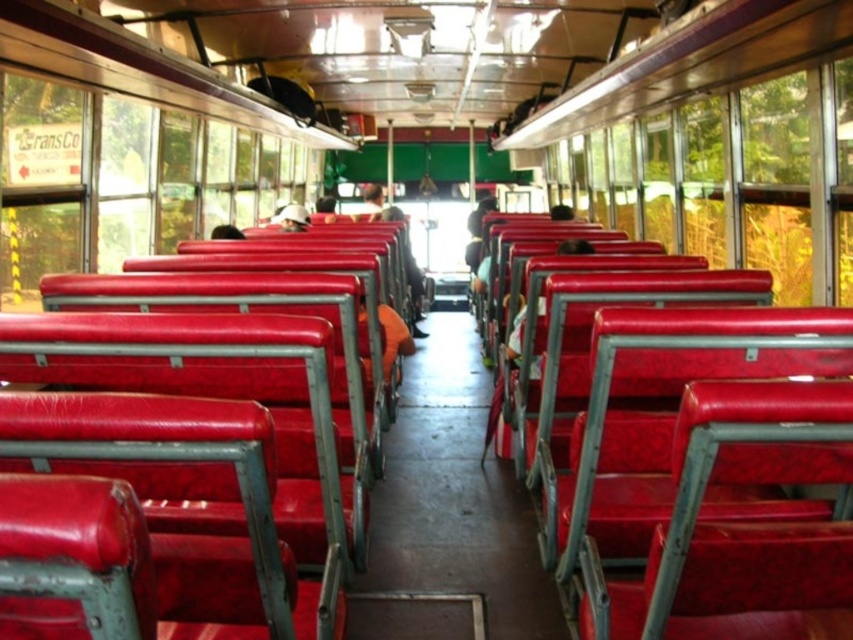
You are a bus passenger who wants to move from the point at (57, 180) to the front of the bus. The bus has a length of 4 meters. Can you reach the front without needing to step over any seats?

The distance between the point at (57, 180) and the front of the bus is 3.93 meters. Since the bus is 4 meters long, you can reach the front without needing to step over any seats as the distance is slightly less than the total length of the bus.

You are a passenger trying to find a seat on the bus. You see two seats at the center of the bus labeled as matte red seats at center and matte red seat at center. Which one is smaller in size?

The matte red seats at center has a smaller size compared to the matte red seat at center.

You are a passenger on the bus and want to know if the matte red seats at center are lower than the matte red seat at center. Can you confirm this?

The matte red seats at center is shorter than matte red seat at center, so yes, the matte red seats at center are lower than the matte red seat at center.